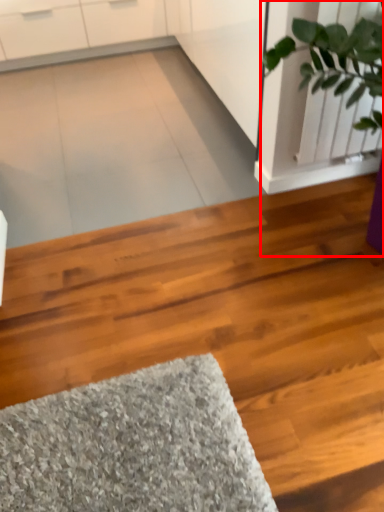
Question: From the image's perspective, where is houseplant (annotated by the red box) located relative to hardwood?

Choices:
 (A) below
 (B) above

Answer: (B)